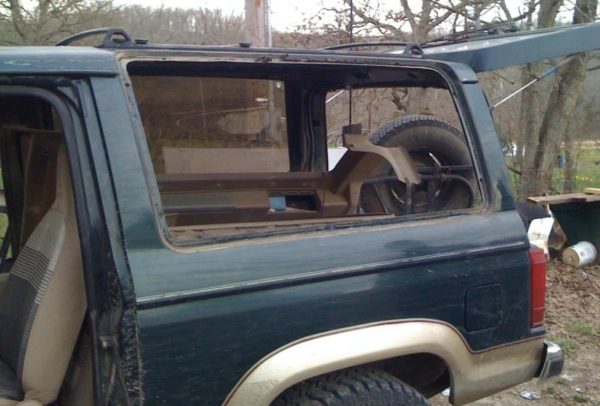
I want to click on window, so click(x=202, y=130).